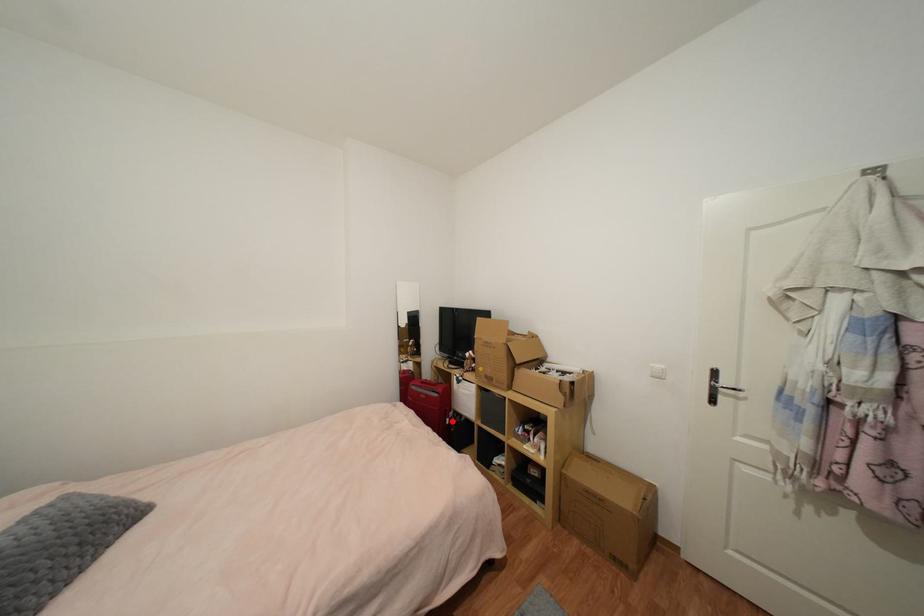
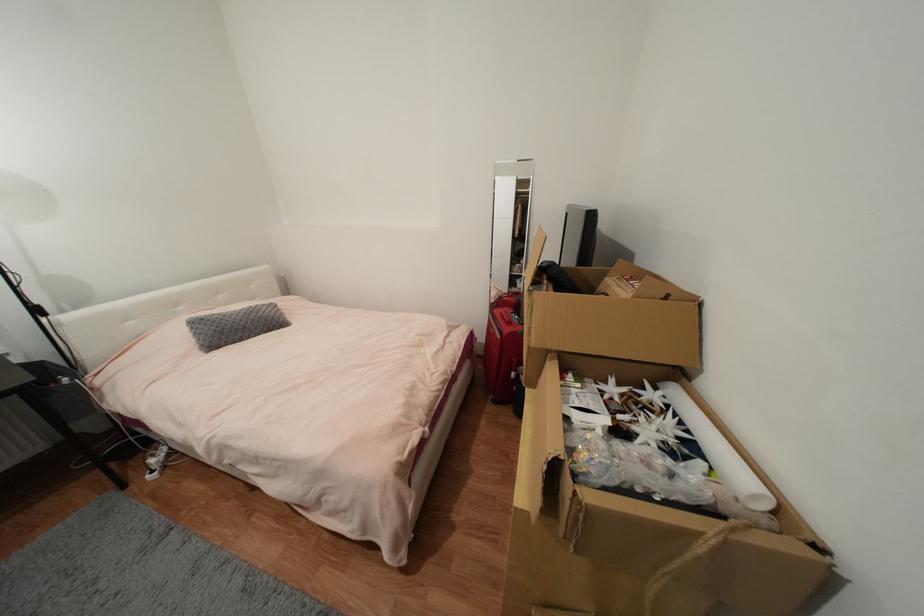
Where in the second image is the point corresponding to the highlighted location from the first image?

(517, 375)